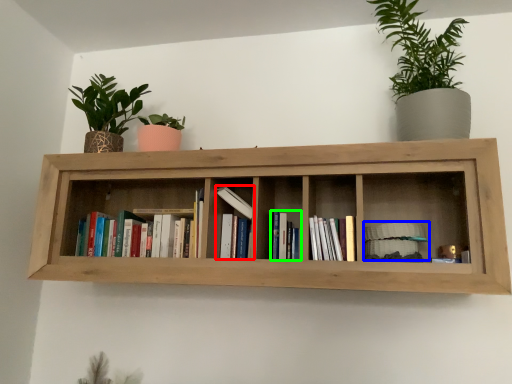
Question: Based on their relative distances, which object is farther from book (highlighted by a red box)? Choose from book (highlighted by a blue box) and book (highlighted by a green box).

Choices:
 (A) book
 (B) book

Answer: (A)